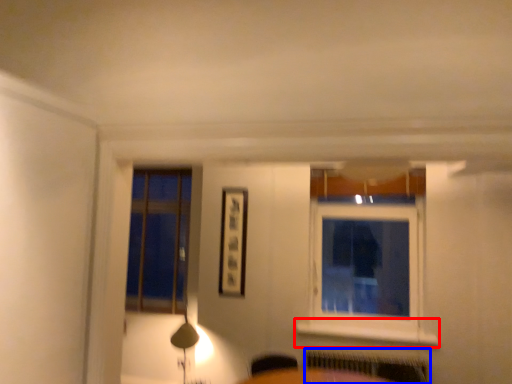
Question: Which of the following is the farthest to the observer, window sill (highlighted by a red box) or radiator (highlighted by a blue box)?

Choices:
 (A) window sill
 (B) radiator

Answer: (A)